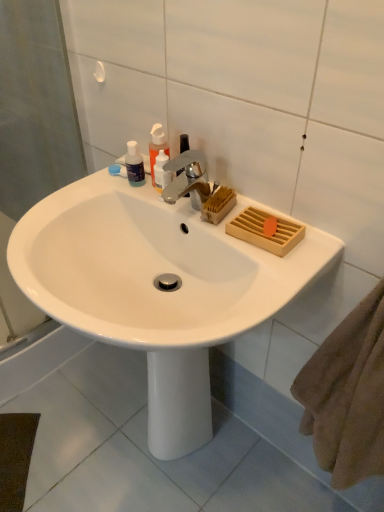
Describe the element at coordinates (161, 172) in the screenshot. I see `translucent plastic bottles at upper left, which ranks as the second toiletry in left-to-right order` at that location.

The width and height of the screenshot is (384, 512). What do you see at coordinates (134, 165) in the screenshot? I see `translucent plastic bottle at upper left, the 1th toiletry viewed from the left` at bounding box center [134, 165].

Where is `white glossy sink at center`? This screenshot has width=384, height=512. white glossy sink at center is located at coordinates (155, 288).

This screenshot has height=512, width=384. Describe the element at coordinates (155, 288) in the screenshot. I see `white glossy sink at center` at that location.

I want to click on translucent plastic bottles at upper left, the first toiletry when ordered from right to left, so click(161, 172).

Is white glossy sink at center positioned beyond the bounds of translucent plastic bottles at upper left, which ranks as the second toiletry in left-to-right order?

Yes.

Is white glossy sink at center with translucent plastic bottles at upper left, the first toiletry when ordered from right to left?

No, white glossy sink at center is not in contact with translucent plastic bottles at upper left, the first toiletry when ordered from right to left.

Can you confirm if white glossy sink at center is positioned to the right of translucent plastic bottles at upper left, which ranks as the second toiletry in left-to-right order?

Incorrect, white glossy sink at center is not on the right side of translucent plastic bottles at upper left, which ranks as the second toiletry in left-to-right order.

Who is taller, white glossy sink at center or translucent plastic bottles at upper left, which ranks as the second toiletry in left-to-right order?

With more height is white glossy sink at center.

Would you say white glossy sink at center is part of translucent plastic bottle at upper left, the 1th toiletry viewed from the left,'s contents?

No.

Can you tell me how much translucent plastic bottle at upper left, the 1th toiletry viewed from the left, and white glossy sink at center differ in facing direction?

translucent plastic bottle at upper left, the 1th toiletry viewed from the left, and white glossy sink at center are facing 7.24 degrees away from each other.

Which is behind, point (139, 178) or point (73, 257)?

The point (139, 178) is behind.

Relative to white glossy sink at center, is translucent plastic bottle at upper left, the 2th toiletry from the right, in front or behind?

In the image, translucent plastic bottle at upper left, the 2th toiletry from the right, appears behind white glossy sink at center.

Who is more distant, translucent plastic bottle at upper left, the 2th toiletry from the right, or translucent plastic soap dispenser at upper center?

Positioned behind is translucent plastic bottle at upper left, the 2th toiletry from the right.

Is translucent plastic bottle at upper left, the 1th toiletry viewed from the left, oriented away from translucent plastic soap dispenser at upper center?

No, translucent plastic bottle at upper left, the 1th toiletry viewed from the left,'s orientation is not away from translucent plastic soap dispenser at upper center.

Is translucent plastic bottle at upper left, the 1th toiletry viewed from the left, inside or outside of translucent plastic soap dispenser at upper center?

translucent plastic bottle at upper left, the 1th toiletry viewed from the left, is outside translucent plastic soap dispenser at upper center.

Which object is positioned more to the right, translucent plastic bottle at upper left, the 1th toiletry viewed from the left, or translucent plastic soap dispenser at upper center?

From the viewer's perspective, translucent plastic soap dispenser at upper center appears more on the right side.

Is translucent plastic bottles at upper left, the first toiletry when ordered from right to left, turned away from translucent plastic soap dispenser at upper center?

No, translucent plastic bottles at upper left, the first toiletry when ordered from right to left, is not facing the opposite direction of translucent plastic soap dispenser at upper center.

How many degrees apart are the facing directions of translucent plastic bottles at upper left, which ranks as the second toiletry in left-to-right order, and translucent plastic soap dispenser at upper center?

There is a 3.38e-05-degree angle between the facing directions of translucent plastic bottles at upper left, which ranks as the second toiletry in left-to-right order, and translucent plastic soap dispenser at upper center.

From a real-world perspective, which object stands above the other?

translucent plastic soap dispenser at upper center.

Identify the location of toiletry in front of the translucent plastic soap dispenser at upper center. The height and width of the screenshot is (512, 384). pos(161,172).

Does translucent plastic bottle at upper left, the 1th toiletry viewed from the left, have a greater height compared to translucent plastic bottles at upper left, which ranks as the second toiletry in left-to-right order?

In fact, translucent plastic bottle at upper left, the 1th toiletry viewed from the left, may be shorter than translucent plastic bottles at upper left, which ranks as the second toiletry in left-to-right order.

Identify the location of toiletry on the right of translucent plastic bottle at upper left, the 1th toiletry viewed from the left. The height and width of the screenshot is (512, 384). (161, 172).

From a real-world perspective, who is located higher, translucent plastic bottle at upper left, the 2th toiletry from the right, or translucent plastic bottles at upper left, which ranks as the second toiletry in left-to-right order?

translucent plastic bottles at upper left, which ranks as the second toiletry in left-to-right order, from a real-world perspective.

Considering the relative sizes of translucent plastic bottles at upper left, which ranks as the second toiletry in left-to-right order, and translucent plastic bottle at upper left, the 1th toiletry viewed from the left, in the image provided, is translucent plastic bottles at upper left, which ranks as the second toiletry in left-to-right order, smaller than translucent plastic bottle at upper left, the 1th toiletry viewed from the left,?

Actually, translucent plastic bottles at upper left, which ranks as the second toiletry in left-to-right order, might be larger than translucent plastic bottle at upper left, the 1th toiletry viewed from the left.

Image resolution: width=384 pixels, height=512 pixels. What are the coordinates of `toiletry below the translucent plastic bottles at upper left, which ranks as the second toiletry in left-to-right order (from a real-world perspective)` in the screenshot? It's located at (134, 165).

From the image's perspective, who appears lower, translucent plastic bottles at upper left, which ranks as the second toiletry in left-to-right order, or translucent plastic bottle at upper left, the 1th toiletry viewed from the left?

translucent plastic bottles at upper left, which ranks as the second toiletry in left-to-right order, from the image's perspective.

In the scene shown: Which object is closer to the camera taking this photo, translucent plastic bottles at upper left, the first toiletry when ordered from right to left, or translucent plastic bottle at upper left, the 2th toiletry from the right?

translucent plastic bottles at upper left, the first toiletry when ordered from right to left, is more forward.

Is white glossy sink at center inside or outside of translucent plastic soap dispenser at upper center?

white glossy sink at center lies outside translucent plastic soap dispenser at upper center.

Can you confirm if white glossy sink at center is taller than translucent plastic soap dispenser at upper center?

Indeed, white glossy sink at center has a greater height compared to translucent plastic soap dispenser at upper center.

Does white glossy sink at center appear on the left side of translucent plastic soap dispenser at upper center?

Correct, you'll find white glossy sink at center to the left of translucent plastic soap dispenser at upper center.

Is white glossy sink at center oriented towards translucent plastic soap dispenser at upper center?

No.

Identify the location of toiletry that appears on the right of white glossy sink at center. (161, 172).

From the image's perspective, count 2nd toiletrys upward from the white glossy sink at center and point to it. Please provide its 2D coordinates.

[(134, 165)]

Which object lies further to the anchor point translucent plastic bottles at upper left, the first toiletry when ordered from right to left, translucent plastic soap dispenser at upper center or white glossy sink at center?

The object further to translucent plastic bottles at upper left, the first toiletry when ordered from right to left, is white glossy sink at center.

Which object lies further to the anchor point white glossy sink at center, translucent plastic soap dispenser at upper center or translucent plastic bottle at upper left, the 2th toiletry from the right?

translucent plastic bottle at upper left, the 2th toiletry from the right.

Looking at this image, estimate the real-world distances between objects in this image. Which object is closer to translucent plastic bottles at upper left, which ranks as the second toiletry in left-to-right order, translucent plastic soap dispenser at upper center or translucent plastic bottle at upper left, the 2th toiletry from the right?

The object closer to translucent plastic bottles at upper left, which ranks as the second toiletry in left-to-right order, is translucent plastic soap dispenser at upper center.

Estimate the real-world distances between objects in this image. Which object is closer to white glossy sink at center, translucent plastic soap dispenser at upper center or translucent plastic bottles at upper left, which ranks as the second toiletry in left-to-right order?

Based on the image, translucent plastic bottles at upper left, which ranks as the second toiletry in left-to-right order, appears to be nearer to white glossy sink at center.

Considering their positions, is translucent plastic bottles at upper left, which ranks as the second toiletry in left-to-right order, positioned further to white glossy sink at center than translucent plastic bottle at upper left, the 1th toiletry viewed from the left?

translucent plastic bottle at upper left, the 1th toiletry viewed from the left.

When comparing their distances from translucent plastic soap dispenser at upper center, does white glossy sink at center or translucent plastic bottle at upper left, the 1th toiletry viewed from the left, seem further?

Among the two, white glossy sink at center is located further to translucent plastic soap dispenser at upper center.

From the image, which object appears to be farther from translucent plastic soap dispenser at upper center, translucent plastic bottle at upper left, the 1th toiletry viewed from the left, or white glossy sink at center?

The object further to translucent plastic soap dispenser at upper center is white glossy sink at center.

Considering their positions, is translucent plastic bottle at upper left, the 1th toiletry viewed from the left, positioned closer to white glossy sink at center than translucent plastic bottles at upper left, the first toiletry when ordered from right to left?

translucent plastic bottles at upper left, the first toiletry when ordered from right to left, is positioned closer to the anchor white glossy sink at center.

What are the coordinates of `soap dispenser between white glossy sink at center and translucent plastic bottle at upper left, the 1th toiletry viewed from the left, in the front-back direction` in the screenshot? It's located at (157, 146).

Where is `soap dispenser between translucent plastic bottle at upper left, the 2th toiletry from the right, and translucent plastic bottles at upper left, the first toiletry when ordered from right to left`? The height and width of the screenshot is (512, 384). soap dispenser between translucent plastic bottle at upper left, the 2th toiletry from the right, and translucent plastic bottles at upper left, the first toiletry when ordered from right to left is located at coordinates (157, 146).

Find the location of a particular element. This screenshot has height=512, width=384. toiletry between white glossy sink at center and translucent plastic soap dispenser at upper center from front to back is located at coordinates (161, 172).

I want to click on toiletry located between white glossy sink at center and translucent plastic bottle at upper left, the 2th toiletry from the right, in the depth direction, so click(x=161, y=172).